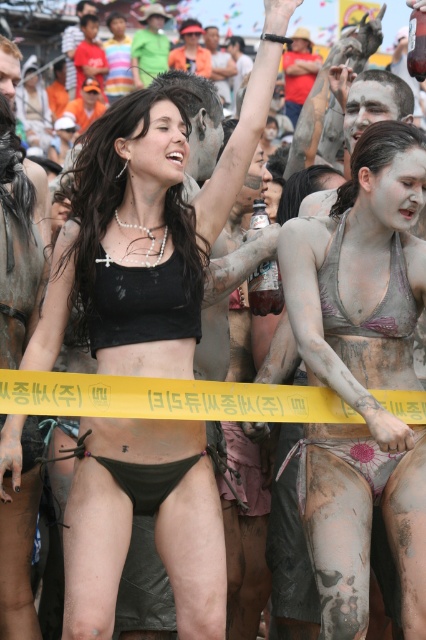
Question: Does black matte bikini bottom at center lie in front of purple metallic bikini top at center?

Choices:
 (A) yes
 (B) no

Answer: (A)

Question: Does matte pink bikini at center appear under purple metallic bikini top at center?

Choices:
 (A) no
 (B) yes

Answer: (B)

Question: Among these objects, which one is farthest from the camera?

Choices:
 (A) purple metallic bikini top at center
 (B) black matte bikini bottom at center
 (C) matte pink bikini at center

Answer: (A)

Question: Which of the following is the farthest from the observer?

Choices:
 (A) tap(324, 298)
 (B) tap(178, 428)

Answer: (A)

Question: Does black matte bikini bottom at center have a smaller size compared to purple metallic bikini top at center?

Choices:
 (A) yes
 (B) no

Answer: (B)

Question: Among these objects, which one is nearest to the camera?

Choices:
 (A) black matte bikini bottom at center
 (B) matte pink bikini at center

Answer: (A)